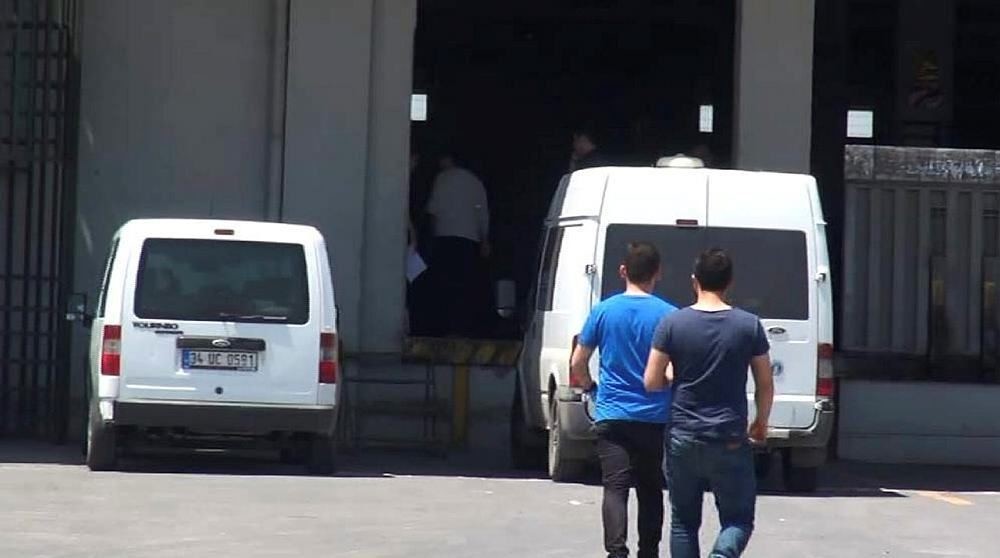
Identify the location of wall. The height and width of the screenshot is (558, 1000). (184, 143).